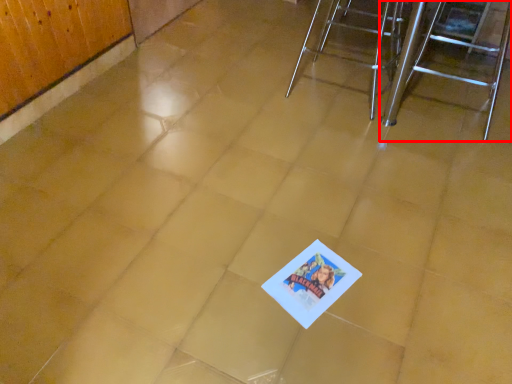
Question: From the image, what is the correct spatial relationship of furniture (annotated by the red box) in relation to furniture?

Choices:
 (A) left
 (B) right

Answer: (B)